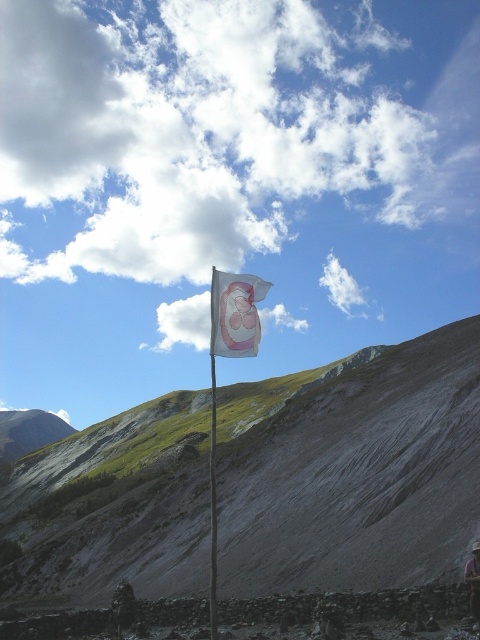
Between pink fabric flag at center and brown leather jacket at lower right, which one is positioned higher?

Positioned higher is pink fabric flag at center.

Is point (245, 323) farther from viewer compared to point (474, 611)?

Yes.

In order to click on pink fabric flag at center in this screenshot , I will do `click(235, 314)`.

Which is in front, point (213, 625) or point (470, 605)?

Positioned in front is point (213, 625).

Can you confirm if white fabric flag at center is positioned to the right of brown leather jacket at lower right?

No, white fabric flag at center is not to the right of brown leather jacket at lower right.

At what (x,y) coordinates should I click in order to perform the action: click on white fabric flag at center. Please return your answer as a coordinate pair (x, y). Image resolution: width=480 pixels, height=640 pixels. Looking at the image, I should click on (213, 508).

Is point (218, 284) positioned in front of point (212, 410)?

Yes, it is.

Is pink fabric flag at center to the right of white fabric flag at center from the viewer's perspective?

Correct, you'll find pink fabric flag at center to the right of white fabric flag at center.

This screenshot has width=480, height=640. Find the location of `pink fabric flag at center`. pink fabric flag at center is located at coordinates click(235, 314).